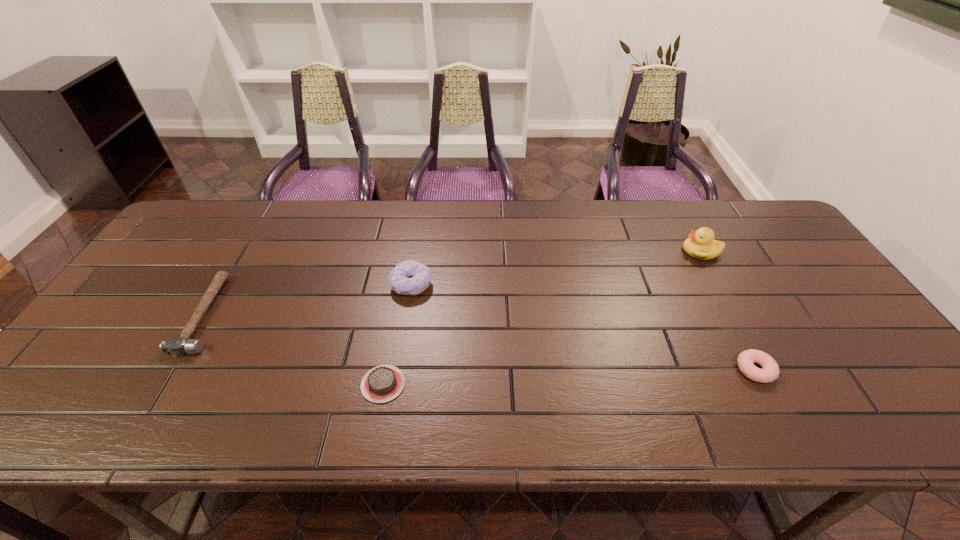
You are a GUI agent. You are given a task and a screenshot of the screen. Output one action in this format:
    pyautogui.click(x=<x>, y=<y>)
    Task: Click on the vacant space that's between the farthest object and the taller doughnut
    Image resolution: width=960 pixels, height=540 pixels.
    Given the screenshot: What is the action you would take?
    pyautogui.click(x=556, y=268)

Where is `vacant area between the farthest object and the chocolate cake`? This screenshot has width=960, height=540. vacant area between the farthest object and the chocolate cake is located at coordinates (542, 318).

You are a GUI agent. You are given a task and a screenshot of the screen. Output one action in this format:
    pyautogui.click(x=<x>, y=<y>)
    Task: Click on the free space between the leftmost object and the farthest object
    The width and height of the screenshot is (960, 540).
    Given the screenshot: What is the action you would take?
    pyautogui.click(x=453, y=283)

Where is `object that stands as the fourth closest to the fourth shortest object`? object that stands as the fourth closest to the fourth shortest object is located at coordinates (770, 372).

Locate which object ranks in proximity to the chocolate cake. Please provide its 2D coordinates. Your answer should be formatted as a tuple, i.e. [(x, y)], where the tuple contains the x and y coordinates of a point satisfying the conditions above.

[(410, 277)]

Where is `free location that satisfies the following two spatial constraints: 1. on the front side of the farther doughnut; 2. on the striking face of the hammer`? free location that satisfies the following two spatial constraints: 1. on the front side of the farther doughnut; 2. on the striking face of the hammer is located at coordinates (407, 314).

Find the location of a particular element. vacant space that satisfies the following two spatial constraints: 1. on the striking face of the shortest object; 2. on the right side of the hammer is located at coordinates (163, 384).

Where is `vacant space that satisfies the following two spatial constraints: 1. on the striking face of the hammer; 2. on the right side of the chocolate cake`? This screenshot has width=960, height=540. vacant space that satisfies the following two spatial constraints: 1. on the striking face of the hammer; 2. on the right side of the chocolate cake is located at coordinates (163, 384).

Where is `free space that satisfies the following two spatial constraints: 1. on the striking face of the shorter doughnut; 2. on the left side of the hammer`? This screenshot has height=540, width=960. free space that satisfies the following two spatial constraints: 1. on the striking face of the shorter doughnut; 2. on the left side of the hammer is located at coordinates (172, 370).